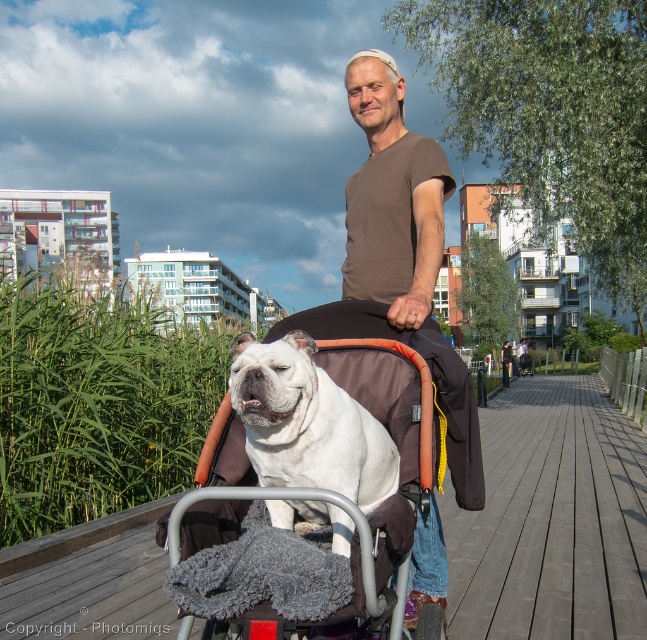
Question: Estimate the real-world distances between objects in this image. Which object is closer to the white fur dog at center?

Choices:
 (A) brown cotton t-shirt at center
 (B) white fabric baby carriage at center

Answer: (B)

Question: Is white fabric baby carriage at center above brown cotton t-shirt at center?

Choices:
 (A) no
 (B) yes

Answer: (A)

Question: Based on their relative distances, which object is farther from the white fur dog at center?

Choices:
 (A) white fabric baby carriage at center
 (B) brown cotton t-shirt at center

Answer: (B)

Question: Can you confirm if white fabric baby carriage at center is positioned above white fur dog at center?

Choices:
 (A) no
 (B) yes

Answer: (A)

Question: Does white fabric baby carriage at center appear over white fur dog at center?

Choices:
 (A) yes
 (B) no

Answer: (B)

Question: Among these points, which one is farthest from the camera?

Choices:
 (A) (397, 93)
 (B) (465, 496)
 (C) (305, 513)

Answer: (A)